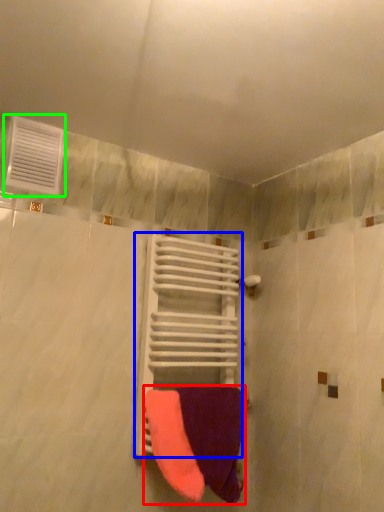
Question: Which object is the closest to the towel (highlighted by a red box)? Choose among these: balustrade (highlighted by a blue box) or air conditioning (highlighted by a green box).

Choices:
 (A) balustrade
 (B) air conditioning

Answer: (A)